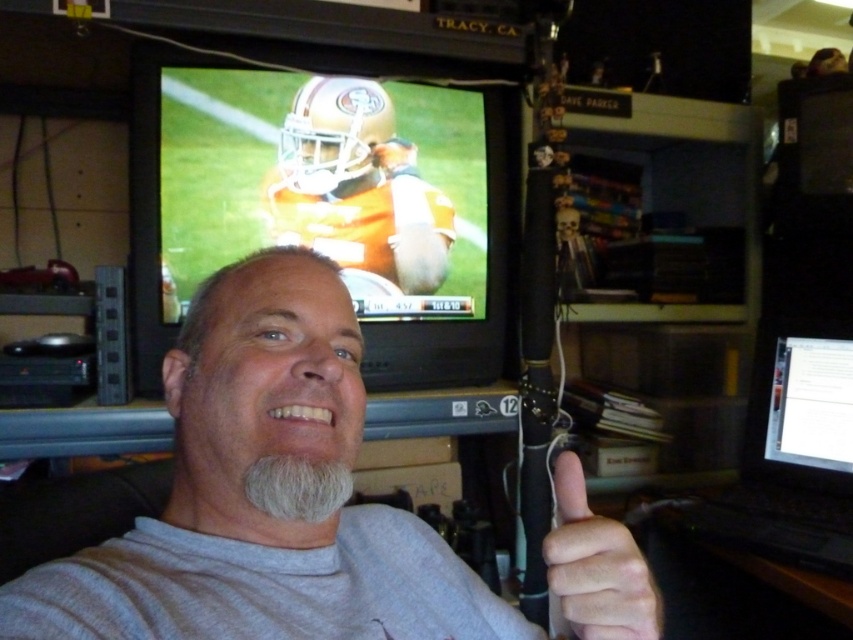
Does skinny white hand at lower right appear on the right side of graywoollybeard at center?

Indeed, skinny white hand at lower right is positioned on the right side of graywoollybeard at center.

Find the location of a particular element. This screenshot has height=640, width=853. skinny white hand at lower right is located at coordinates (595, 566).

Between point (590, 556) and point (347, 470), which one is positioned in front?

Positioned in front is point (590, 556).

Locate an element on the screen. This screenshot has height=640, width=853. skinny white hand at lower right is located at coordinates (595, 566).

Is gray matte shirt at center to the right of skinny white hand at lower right from the viewer's perspective?

No, gray matte shirt at center is not to the right of skinny white hand at lower right.

What do you see at coordinates (251, 504) in the screenshot? This screenshot has height=640, width=853. I see `gray matte shirt at center` at bounding box center [251, 504].

Where is `gray matte shirt at center`? gray matte shirt at center is located at coordinates (251, 504).

Is black plastic laptop at right thinner than skinny white hand at lower right?

No.

Does point (838, 561) come closer to viewer compared to point (583, 484)?

No, (838, 561) is further to viewer.

Is point (799, 556) positioned in front of point (648, 627)?

That is False.

Locate an element on the screen. black plastic laptop at right is located at coordinates (792, 452).